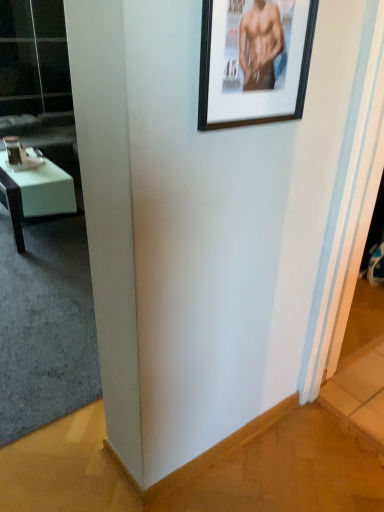
Question: From a real-world perspective, relative to black matte picture frame at upper right, is transparent glass door at upper left vertically above or below?

Choices:
 (A) above
 (B) below

Answer: (B)

Question: Is transparent glass door at upper left bigger or smaller than black matte picture frame at upper right?

Choices:
 (A) small
 (B) big

Answer: (B)

Question: Estimate the real-world distances between objects in this image. Which object is closer to the white leather couch at left?

Choices:
 (A) black matte picture frame at upper right
 (B) white glossy desk at left
 (C) transparent glass door at upper left

Answer: (C)

Question: Which of these objects is positioned closest to the transparent glass door at upper left?

Choices:
 (A) black matte picture frame at upper right
 (B) white glossy desk at left
 (C) white leather couch at left

Answer: (C)